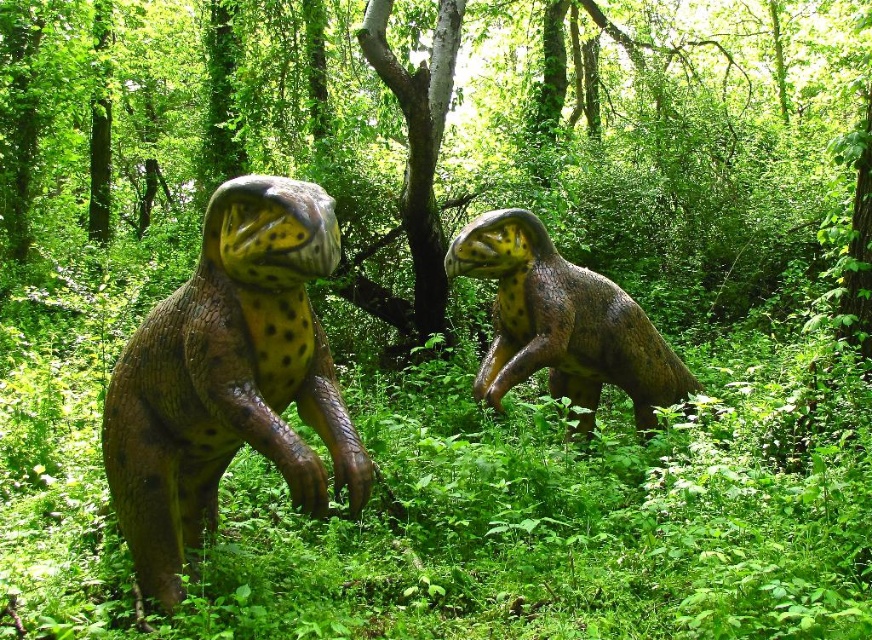
You are a park visitor trying to take a photo of both the brown textured dinosaur at left and the brown textured dinosaur at center. Since you want both dinosaurs in the frame, which dinosaur should you position closer to the camera to ensure both fit in the photo?

You should position the brown textured dinosaur at left closer to the camera because it occupies less space than the brown textured dinosaur at center, allowing both to fit within the photo frame.

You are a visitor at a dinosaur exhibit and want to take a photo of both the brown textured dinosaur at left and the brown textured dinosaur at center. If your camera can focus on objects within a 5 feet range, will you be able to capture both dinosaurs in one shot?

The brown textured dinosaur at left is 7.37 feet away from the brown textured dinosaur at center. Since the camera can only focus within 5 feet, the distance between them exceeds the camera range, so you cannot capture both dinosaurs in one shot.

You are a park ranger in a dinosaur exhibit and need to locate the brown textured dinosaur at left. According to the coordinates provided, where exactly is it positioned?

The brown textured dinosaur at left is positioned at coordinates point (229, 378).